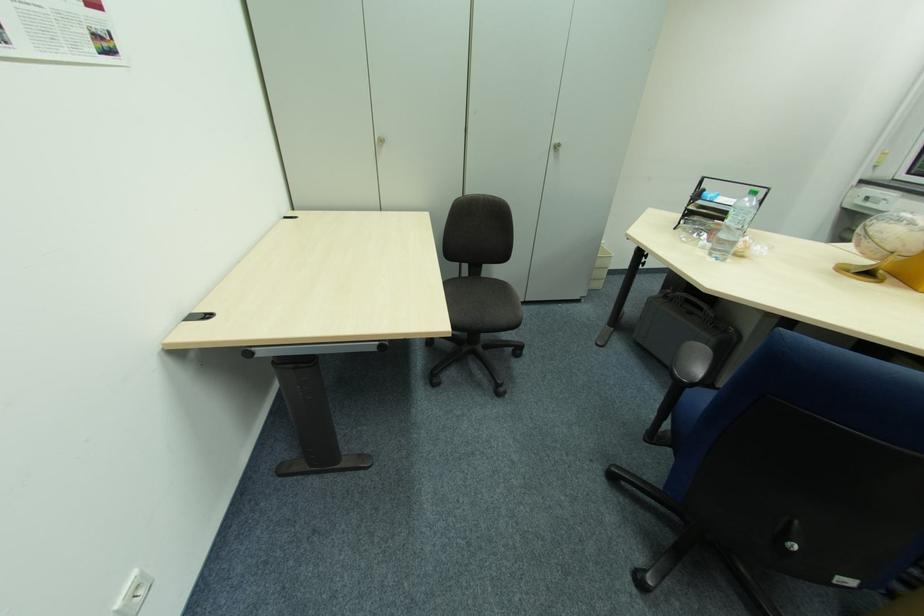
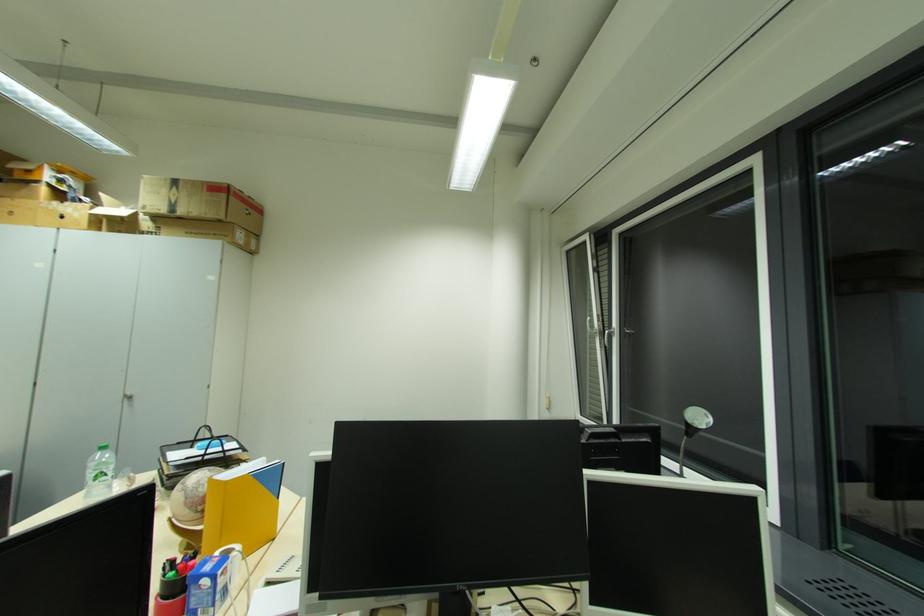
Where in the second image is the point corresponding to (x=554, y=150) from the first image?

(128, 400)